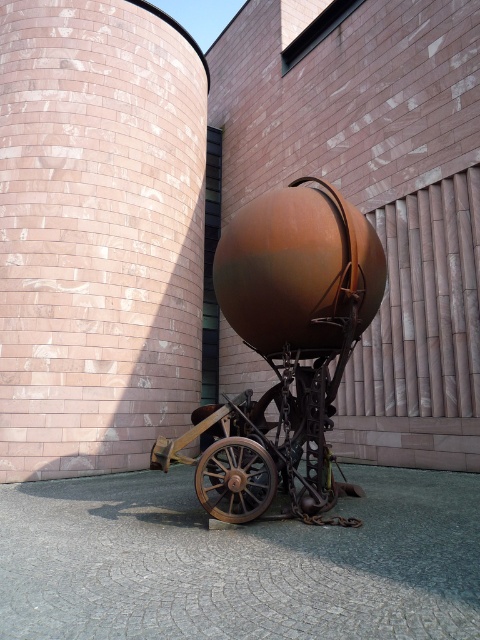
Question: Which object is farther from the camera taking this photo?

Choices:
 (A) rusty metal wagon at center
 (B) rusty metal sphere at center
 (C) rustic brick pillar at center

Answer: (C)

Question: Which of the following is the farthest from the observer?

Choices:
 (A) rustic brick pillar at center
 (B) rusty metal wagon at center

Answer: (A)

Question: Which point is closer to the camera?

Choices:
 (A) rusty metal wagon at center
 (B) rustic wood wheel at lower center
 (C) rustic brick pillar at center
 (D) rusty metal sphere at center

Answer: (D)

Question: Observing the image, what is the correct spatial positioning of rustic brick pillar at center in reference to rusty metal wagon at center?

Choices:
 (A) left
 (B) right

Answer: (A)

Question: Can you confirm if rusty metal sphere at center is positioned to the right of rustic wood wheel at lower center?

Choices:
 (A) yes
 (B) no

Answer: (A)

Question: Can you confirm if rustic brick pillar at center is positioned to the right of rusty metal sphere at center?

Choices:
 (A) no
 (B) yes

Answer: (A)